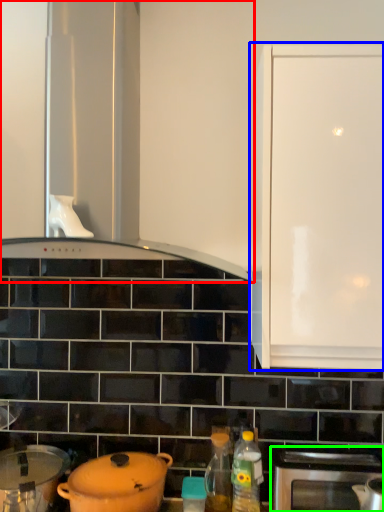
Question: Which object is the farthest from home appliance (highlighted by a red box)? Choose among these: cabinetry (highlighted by a blue box) or oven (highlighted by a green box).

Choices:
 (A) cabinetry
 (B) oven

Answer: (B)